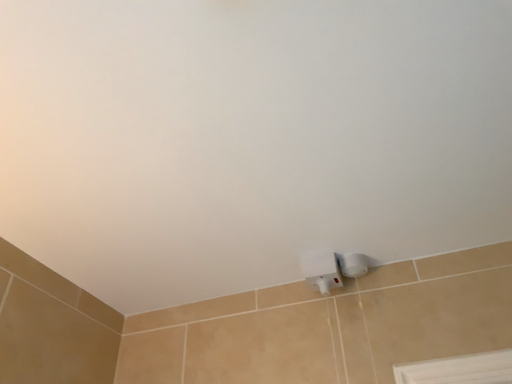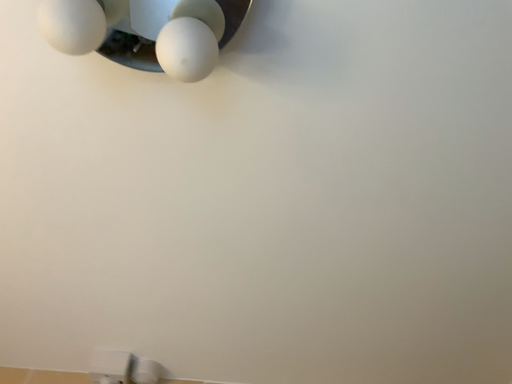
Question: Which way did the camera rotate in the video?

Choices:
 (A) rotated downward
 (B) rotated upward

Answer: (B)